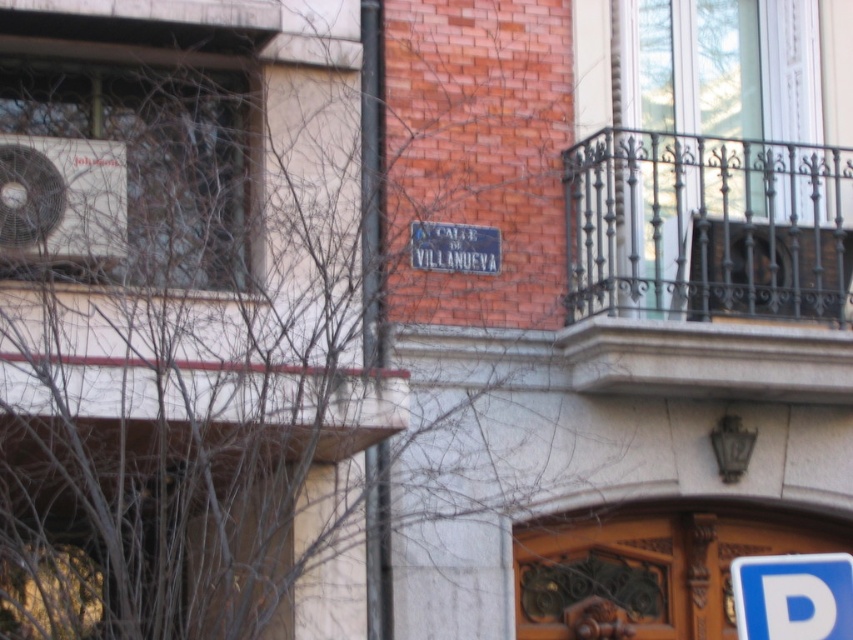
You are standing at the entrance of the building and want to locate the matte black air conditioner at upper left. Based on the coordinates provided, where should you look relative to the building?

The matte black air conditioner at upper left is located at coordinates point (61, 198), which is on the upper left side of the building.

You are a window cleaner standing on the ground floor. You need to clean both the black wrought iron balcony at upper right and the matte black air conditioner at upper left. Which object will require you to climb a ladder higher?

The black wrought iron balcony at upper right will require climbing a ladder higher because it is much taller than the matte black air conditioner at upper left.